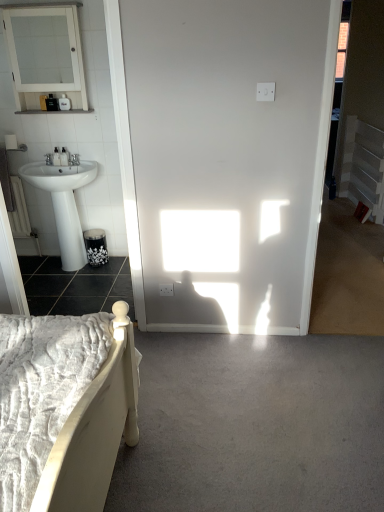
Image resolution: width=384 pixels, height=512 pixels. Find the location of `vacant area that is situated to the right of matte black soap dispenser at left, which appears as the 2th toiletry when ordered from the bottom`. vacant area that is situated to the right of matte black soap dispenser at left, which appears as the 2th toiletry when ordered from the bottom is located at coordinates (79, 165).